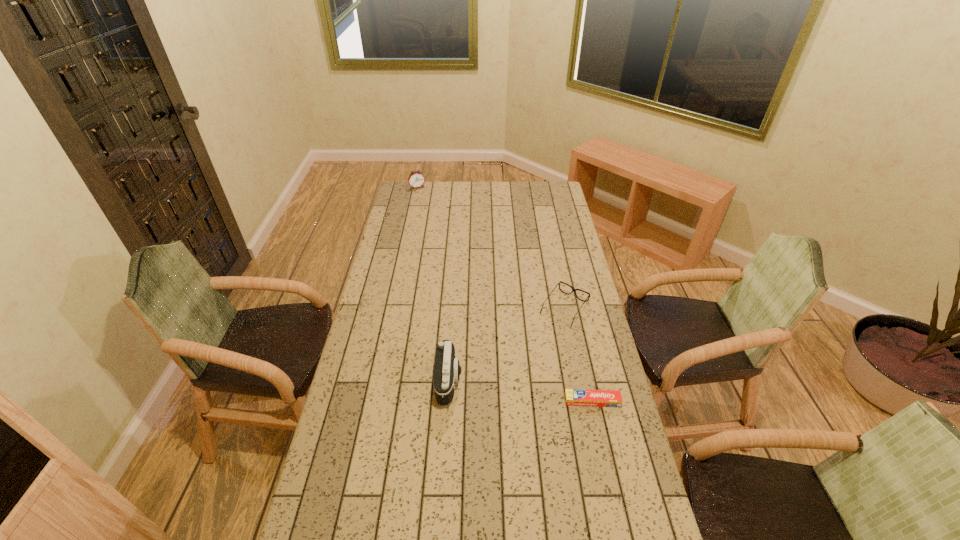
This screenshot has width=960, height=540. Find the location of `vacant space situated on the clock face of the third shortest object`. vacant space situated on the clock face of the third shortest object is located at coordinates (438, 225).

This screenshot has height=540, width=960. Identify the location of vacant space situated with the lenses facing outward on the spectacles. (537, 346).

Identify the location of free spot located with the lenses facing outward on the spectacles. (511, 379).

The height and width of the screenshot is (540, 960). In order to click on free space located with the lenses facing outward on the spectacles in this screenshot , I will do `click(533, 351)`.

You are a GUI agent. You are given a task and a screenshot of the screen. Output one action in this format:
    pyautogui.click(x=<x>, y=<y>)
    Task: Click on the object at the far edge
    This screenshot has width=960, height=540.
    Given the screenshot: What is the action you would take?
    (x=416, y=179)

What are the coordinates of `object positioned at the left edge` in the screenshot? It's located at (416, 179).

Identify the location of toothpaste that is positioned at the right edge. (573, 397).

Locate an element on the screen. spectacles at the right edge is located at coordinates (573, 290).

Identify the location of object at the far left corner. (416, 179).

In the image, there is a desktop. Identify the location of free space at the far edge. Image resolution: width=960 pixels, height=540 pixels. [x=526, y=183].